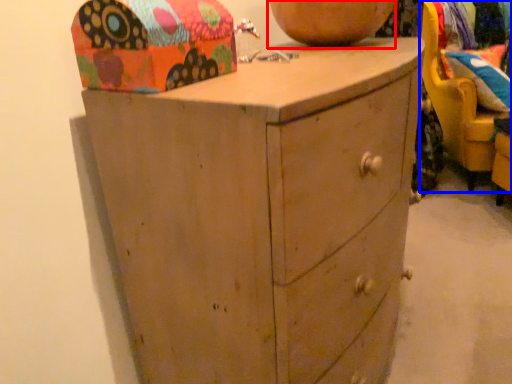
Question: Which point is further to the camera, vase (highlighted by a red box) or swivel chair (highlighted by a blue box)?

Choices:
 (A) vase
 (B) swivel chair

Answer: (B)